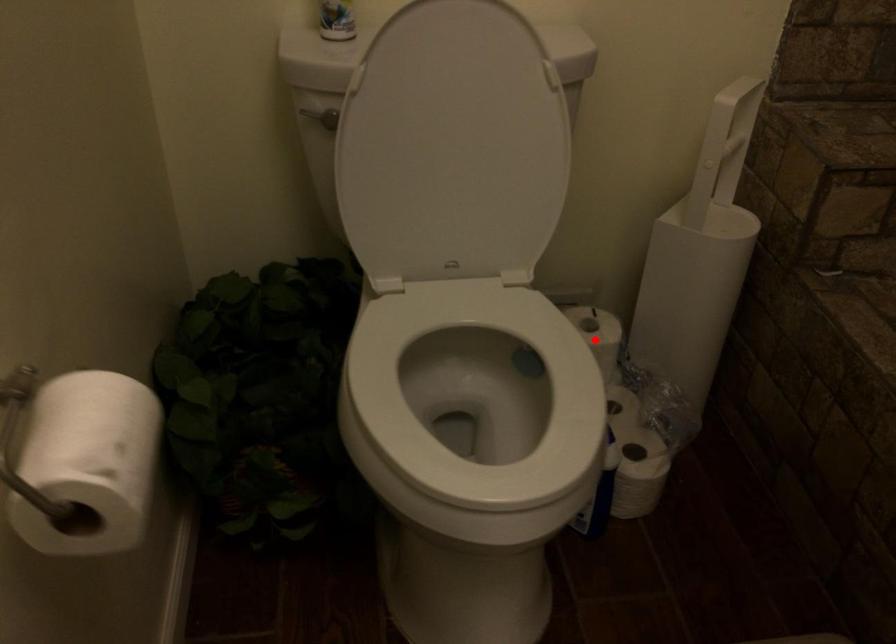
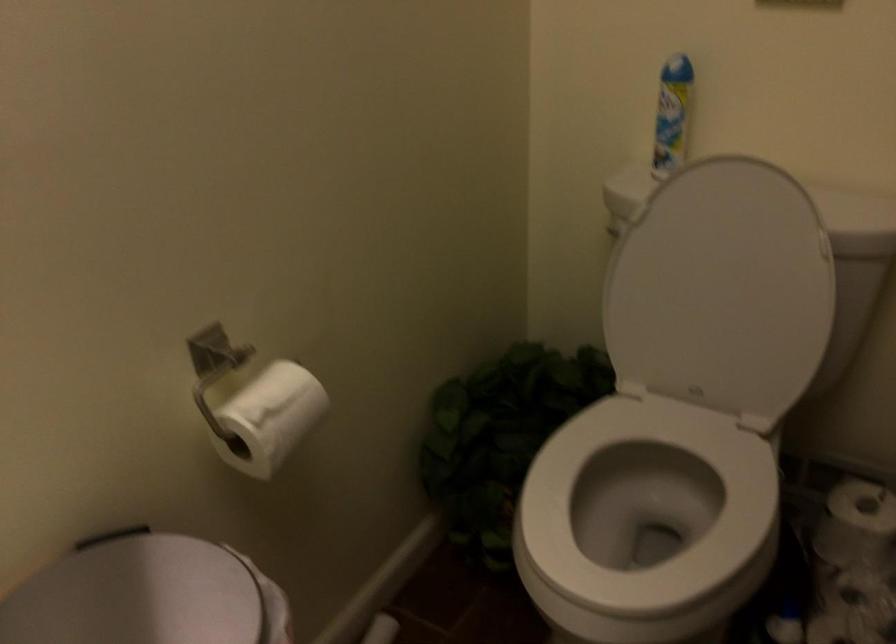
Where in the second image is the point corresponding to the highlighted location from the first image?

(856, 523)